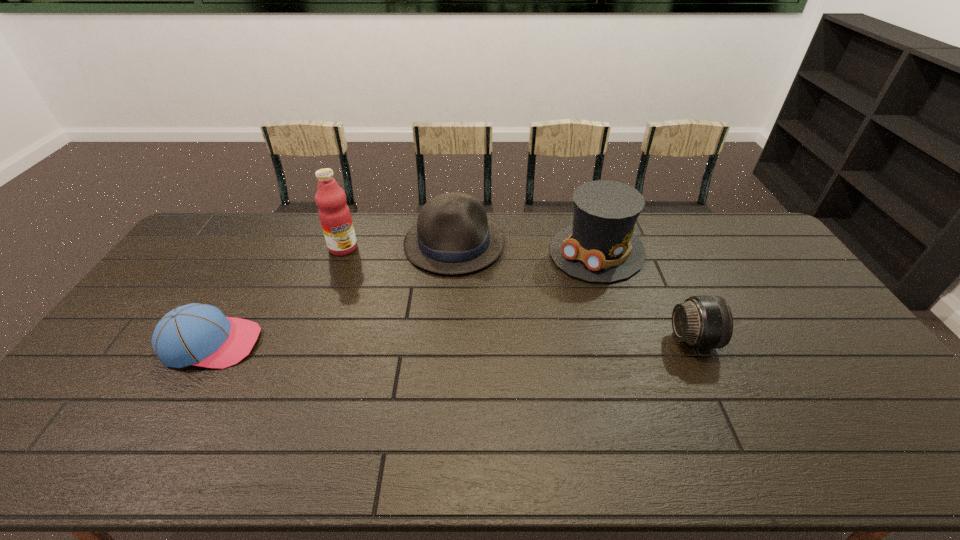
You are a GUI agent. You are given a task and a screenshot of the screen. Output one action in this format:
    pyautogui.click(x=<x>, y=<y>)
    Task: Click on the vacant space on the desktop that is between the shortest object and the telephoto lens and is positioned on the front-facing side of the third tallest object
    
    Given the screenshot: What is the action you would take?
    pyautogui.click(x=458, y=341)

You are a GUI agent. You are given a task and a screenshot of the screen. Output one action in this format:
    pyautogui.click(x=<x>, y=<y>)
    Task: Click on the vacant spot on the desktop that is between the shortest object and the telephoto lens and is positioned with goggles on the front of the second tallest object
    The width and height of the screenshot is (960, 540).
    Given the screenshot: What is the action you would take?
    [x=505, y=341]

Where is `free space on the desktop that is between the baseball cap and the telephoto lens and is positioned on the label of the fruit juice`? The image size is (960, 540). free space on the desktop that is between the baseball cap and the telephoto lens and is positioned on the label of the fruit juice is located at coordinates (386, 342).